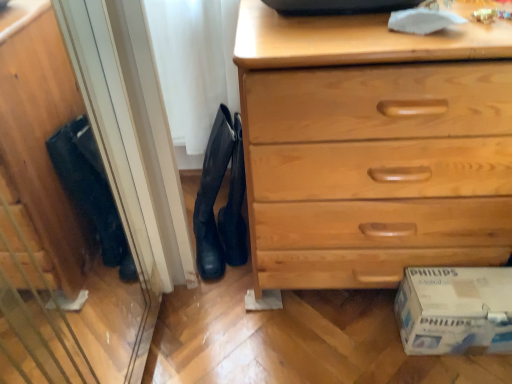
The image size is (512, 384). I want to click on free space that is in between light wood chest of drawers at lower right and black leather boots at center, so click(x=241, y=291).